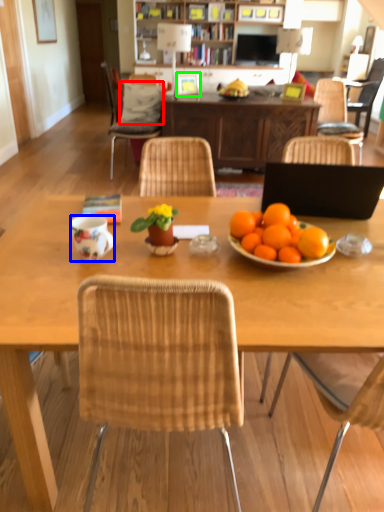
Question: Based on their relative distances, which object is farther from pillow (highlighted by a red box)? Choose from coffee cup (highlighted by a blue box) and picture frame (highlighted by a green box).

Choices:
 (A) coffee cup
 (B) picture frame

Answer: (A)